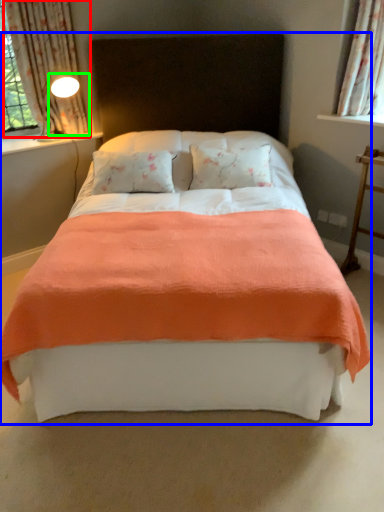
Question: Which object is positioned farthest from curtain (highlighted by a red box)? Select from bed (highlighted by a blue box) and light fixture (highlighted by a green box).

Choices:
 (A) bed
 (B) light fixture

Answer: (A)